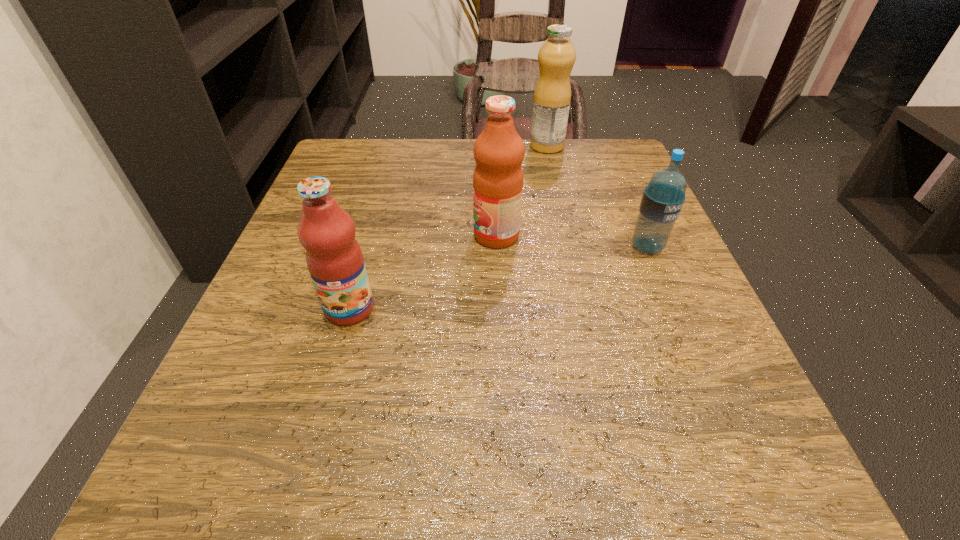
Identify the location of free space between the leftmost fruit juice and the second farthest fruit juice. Image resolution: width=960 pixels, height=540 pixels. (423, 272).

Find the location of a particular element. Image resolution: width=960 pixels, height=540 pixels. free space between the nearest object and the rightmost object is located at coordinates (498, 278).

Identify the location of empty space that is in between the rightmost fruit juice and the rightmost object. (597, 197).

What are the coordinates of `vacant region between the rightmost object and the farthest object` in the screenshot? It's located at (597, 197).

You are a GUI agent. You are given a task and a screenshot of the screen. Output one action in this format:
    pyautogui.click(x=<x>, y=<y>)
    Task: Click on the unoccupied position between the nearest object and the rightmost object
    The image size is (960, 540).
    Given the screenshot: What is the action you would take?
    pyautogui.click(x=498, y=278)

Identify the location of vacant area that lies between the water bottle and the nearest object. This screenshot has width=960, height=540. (498, 278).

You are a GUI agent. You are given a task and a screenshot of the screen. Output one action in this format:
    pyautogui.click(x=<x>, y=<y>)
    Task: Click on the empty space between the water bottle and the farthest object
    The height and width of the screenshot is (540, 960).
    Given the screenshot: What is the action you would take?
    pyautogui.click(x=597, y=197)

Locate an element on the screen. The width and height of the screenshot is (960, 540). object that stands as the closest to the leftmost fruit juice is located at coordinates (499, 151).

Identify which object is the second nearest to the nearest fruit juice. Please provide its 2D coordinates. Your answer should be formatted as a tuple, i.e. [(x, y)], where the tuple contains the x and y coordinates of a point satisfying the conditions above.

[(663, 198)]

This screenshot has width=960, height=540. Find the location of `fruit juice that is the second closest to the nearest object`. fruit juice that is the second closest to the nearest object is located at coordinates (552, 96).